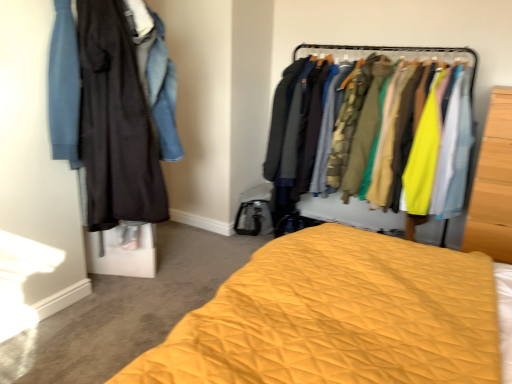
Describe the element at coordinates (156, 77) in the screenshot. I see `denim jacket at left, the 2th clothing ordered from the bottom` at that location.

Measure the distance between denim jacket at left, which is counted as the first clothing, starting from the top, and camera.

They are 6.29 feet apart.

How much space does matte black coat at left, which appears as the 1th clothing when ordered from the bottom, occupy vertically?

1.07 meters.

This screenshot has width=512, height=384. In order to click on textured fabric clothes at center in this screenshot , I will do `click(369, 116)`.

Image resolution: width=512 pixels, height=384 pixels. What do you see at coordinates (338, 317) in the screenshot? I see `yellow quilted bed at center` at bounding box center [338, 317].

The image size is (512, 384). I want to click on denim jacket at left, which is counted as the first clothing, starting from the top, so click(x=156, y=77).

Is yellow quilted bed at center positioned with its back to matte black coat at left, placed as the second clothing when sorted from top to bottom?

That's not correct — yellow quilted bed at center is not looking away from matte black coat at left, placed as the second clothing when sorted from top to bottom.

How different are the orientations of yellow quilted bed at center and matte black coat at left, which appears as the 1th clothing when ordered from the bottom, in degrees?

118 degrees separate the facing orientations of yellow quilted bed at center and matte black coat at left, which appears as the 1th clothing when ordered from the bottom.

Is yellow quilted bed at center located outside matte black coat at left, which appears as the 1th clothing when ordered from the bottom?

Yes, yellow quilted bed at center is outside of matte black coat at left, which appears as the 1th clothing when ordered from the bottom.

Is yellow quilted bed at center wider or thinner than matte black coat at left, placed as the second clothing when sorted from top to bottom?

yellow quilted bed at center is wider than matte black coat at left, placed as the second clothing when sorted from top to bottom.

Considering the relative sizes of denim jacket at left, which is counted as the first clothing, starting from the top, and textured fabric clothes at center in the image provided, is denim jacket at left, which is counted as the first clothing, starting from the top, thinner than textured fabric clothes at center?

Correct, the width of denim jacket at left, which is counted as the first clothing, starting from the top, is less than that of textured fabric clothes at center.

Measure the distance between denim jacket at left, the 2th clothing ordered from the bottom, and textured fabric clothes at center.

denim jacket at left, the 2th clothing ordered from the bottom, is 3.71 feet from textured fabric clothes at center.

Would you say denim jacket at left, which is counted as the first clothing, starting from the top, contains textured fabric clothes at center?

That's incorrect, textured fabric clothes at center is not inside denim jacket at left, which is counted as the first clothing, starting from the top.

Can you confirm if denim jacket at left, the 2th clothing ordered from the bottom, is positioned to the left of textured fabric clothes at center?

Indeed, denim jacket at left, the 2th clothing ordered from the bottom, is positioned on the left side of textured fabric clothes at center.

Can you confirm if matte black coat at left, placed as the second clothing when sorted from top to bottom, is wider than denim jacket at left, which is counted as the first clothing, starting from the top?

No.

Considering the sizes of matte black coat at left, placed as the second clothing when sorted from top to bottom, and denim jacket at left, the 2th clothing ordered from the bottom, in the image, is matte black coat at left, placed as the second clothing when sorted from top to bottom, bigger or smaller than denim jacket at left, the 2th clothing ordered from the bottom,?

matte black coat at left, placed as the second clothing when sorted from top to bottom, is bigger than denim jacket at left, the 2th clothing ordered from the bottom.

Considering the positions of objects matte black coat at left, placed as the second clothing when sorted from top to bottom, and denim jacket at left, the 2th clothing ordered from the bottom, in the image provided, who is more to the right, matte black coat at left, placed as the second clothing when sorted from top to bottom, or denim jacket at left, the 2th clothing ordered from the bottom,?

denim jacket at left, the 2th clothing ordered from the bottom.

Can you confirm if matte black coat at left, which appears as the 1th clothing when ordered from the bottom, is shorter than denim jacket at left, which is counted as the first clothing, starting from the top?

Incorrect, the height of matte black coat at left, which appears as the 1th clothing when ordered from the bottom, does not fall short of that of denim jacket at left, which is counted as the first clothing, starting from the top.

Based on their positions, is yellow quilted bed at center located to the left or right of denim jacket at left, which is counted as the first clothing, starting from the top?

Based on their positions, yellow quilted bed at center is located to the right of denim jacket at left, which is counted as the first clothing, starting from the top.

Based on the photo, is yellow quilted bed at center turned away from denim jacket at left, the 2th clothing ordered from the bottom?

No, denim jacket at left, the 2th clothing ordered from the bottom, is not at the back of yellow quilted bed at center.

Where is `the 1st clothing counting from the left side of the yellow quilted bed at center`? the 1st clothing counting from the left side of the yellow quilted bed at center is located at coordinates (156, 77).

Is denim jacket at left, which is counted as the first clothing, starting from the top, inside yellow quilted bed at center?

No, denim jacket at left, which is counted as the first clothing, starting from the top, is not surrounded by yellow quilted bed at center.

Would you say matte black coat at left, which appears as the 1th clothing when ordered from the bottom, is outside wooden wardrobe at right?

Yes, matte black coat at left, which appears as the 1th clothing when ordered from the bottom, is located beyond the bounds of wooden wardrobe at right.

From the image's perspective, is matte black coat at left, placed as the second clothing when sorted from top to bottom, below wooden wardrobe at right?

No.

Is matte black coat at left, placed as the second clothing when sorted from top to bottom, directly adjacent to wooden wardrobe at right?

No, matte black coat at left, placed as the second clothing when sorted from top to bottom, is not beside wooden wardrobe at right.

Between matte black coat at left, placed as the second clothing when sorted from top to bottom, and wooden wardrobe at right, which one has larger width?

wooden wardrobe at right is wider.

From a real-world perspective, is yellow quilted bed at center positioned under wooden wardrobe at right based on gravity?

Indeed, from a real-world perspective, yellow quilted bed at center is positioned beneath wooden wardrobe at right.

Locate an element on the screen. bed on the left side of wooden wardrobe at right is located at coordinates (338, 317).

Is textured fabric clothes at center facing away from wooden wardrobe at right?

textured fabric clothes at center is not turned away from wooden wardrobe at right.

Looking at this image, considering the sizes of objects textured fabric clothes at center and wooden wardrobe at right in the image provided, who is smaller, textured fabric clothes at center or wooden wardrobe at right?

wooden wardrobe at right.

Relative to wooden wardrobe at right, is textured fabric clothes at center in front or behind?

textured fabric clothes at center is positioned farther from the viewer than wooden wardrobe at right.

Would you say textured fabric clothes at center is outside wooden wardrobe at right?

textured fabric clothes at center is positioned outside wooden wardrobe at right.

The width and height of the screenshot is (512, 384). Identify the location of the 1st clothing above the yellow quilted bed at center (from the image's perspective). (116, 122).

Identify the location of closet on the right of denim jacket at left, the 2th clothing ordered from the bottom. (369, 116).

Which object lies further to the anchor point wooden wardrobe at right, matte black coat at left, placed as the second clothing when sorted from top to bottom, or yellow quilted bed at center?

The object further to wooden wardrobe at right is matte black coat at left, placed as the second clothing when sorted from top to bottom.

Which object lies further to the anchor point denim jacket at left, the 2th clothing ordered from the bottom, matte black coat at left, which appears as the 1th clothing when ordered from the bottom, or yellow quilted bed at center?

yellow quilted bed at center lies further to denim jacket at left, the 2th clothing ordered from the bottom, than the other object.

Which object lies nearer to the anchor point wooden wardrobe at right, yellow quilted bed at center or matte black coat at left, placed as the second clothing when sorted from top to bottom?

Based on the image, yellow quilted bed at center appears to be nearer to wooden wardrobe at right.

When comparing their distances from textured fabric clothes at center, does denim jacket at left, which is counted as the first clothing, starting from the top, or yellow quilted bed at center seem further?

Among the two, yellow quilted bed at center is located further to textured fabric clothes at center.

Considering their positions, is wooden wardrobe at right positioned further to denim jacket at left, the 2th clothing ordered from the bottom, than matte black coat at left, which appears as the 1th clothing when ordered from the bottom?

Based on the image, wooden wardrobe at right appears to be further to denim jacket at left, the 2th clothing ordered from the bottom.

Considering their positions, is matte black coat at left, which appears as the 1th clothing when ordered from the bottom, positioned further to textured fabric clothes at center than wooden wardrobe at right?

matte black coat at left, which appears as the 1th clothing when ordered from the bottom, lies further to textured fabric clothes at center than the other object.

Considering their positions, is textured fabric clothes at center positioned further to wooden wardrobe at right than matte black coat at left, which appears as the 1th clothing when ordered from the bottom?

Among the two, matte black coat at left, which appears as the 1th clothing when ordered from the bottom, is located further to wooden wardrobe at right.

From the image, which object appears to be farther from denim jacket at left, the 2th clothing ordered from the bottom, textured fabric clothes at center or wooden wardrobe at right?

wooden wardrobe at right is positioned further to the anchor denim jacket at left, the 2th clothing ordered from the bottom.

Locate an element on the screen. bed between matte black coat at left, which appears as the 1th clothing when ordered from the bottom, and wooden wardrobe at right, in the horizontal direction is located at coordinates (338, 317).

Where is `closet between matte black coat at left, which appears as the 1th clothing when ordered from the bottom, and wooden wardrobe at right from left to right`? closet between matte black coat at left, which appears as the 1th clothing when ordered from the bottom, and wooden wardrobe at right from left to right is located at coordinates (369, 116).

The width and height of the screenshot is (512, 384). In order to click on closet between denim jacket at left, the 2th clothing ordered from the bottom, and wooden wardrobe at right in this screenshot , I will do `click(369, 116)`.

The width and height of the screenshot is (512, 384). Find the location of `clothing between denim jacket at left, the 2th clothing ordered from the bottom, and yellow quilted bed at center from top to bottom`. clothing between denim jacket at left, the 2th clothing ordered from the bottom, and yellow quilted bed at center from top to bottom is located at coordinates (116, 122).